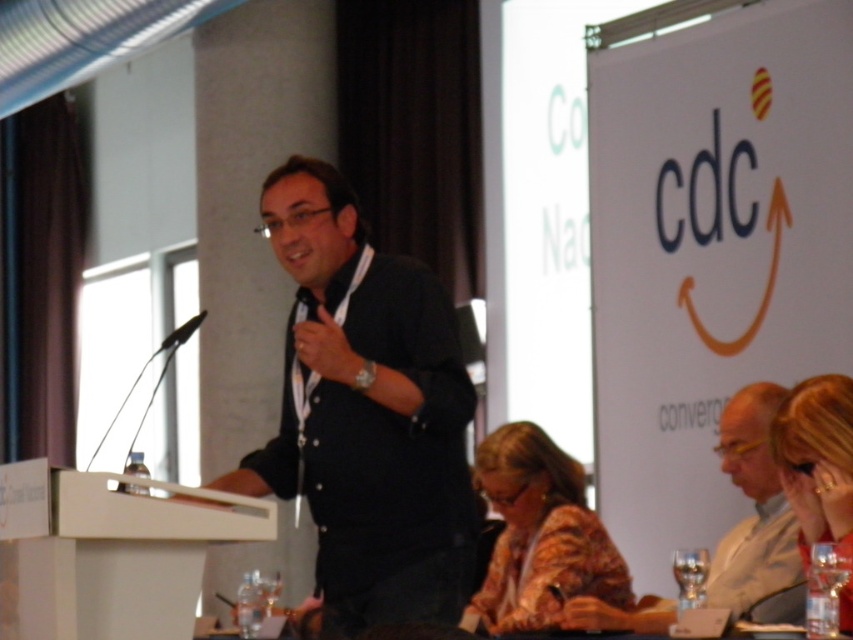
Does blonde hair at upper right lie in front of black matte microphone at left?

That is True.

How far apart are blonde hair at upper right and black matte microphone at left?

blonde hair at upper right and black matte microphone at left are 17.21 feet apart from each other.

Which is in front, point (844, 602) or point (167, 346)?

Positioned in front is point (844, 602).

Where is `blonde hair at upper right`? blonde hair at upper right is located at coordinates (817, 468).

Is blonde hair at upper right smaller than transparent glass at lower right?

Actually, blonde hair at upper right might be larger than transparent glass at lower right.

From the picture: Is blonde hair at upper right closer to camera compared to transparent glass at lower right?

Yes, blonde hair at upper right is closer to the viewer.

Between point (827, 484) and point (697, 573), which one is positioned behind?

The point (697, 573) is behind.

I want to click on blonde hair at upper right, so click(817, 468).

Find the location of a particular element. The width and height of the screenshot is (853, 640). black matte shirt at center is located at coordinates (366, 413).

Which of these two, black matte shirt at center or floral fabric blouse at lower center, stands taller?

black matte shirt at center

Which is in front, point (358, 308) or point (582, 509)?

Point (358, 308) is in front.

Locate an element on the screen. black matte shirt at center is located at coordinates pyautogui.click(x=366, y=413).